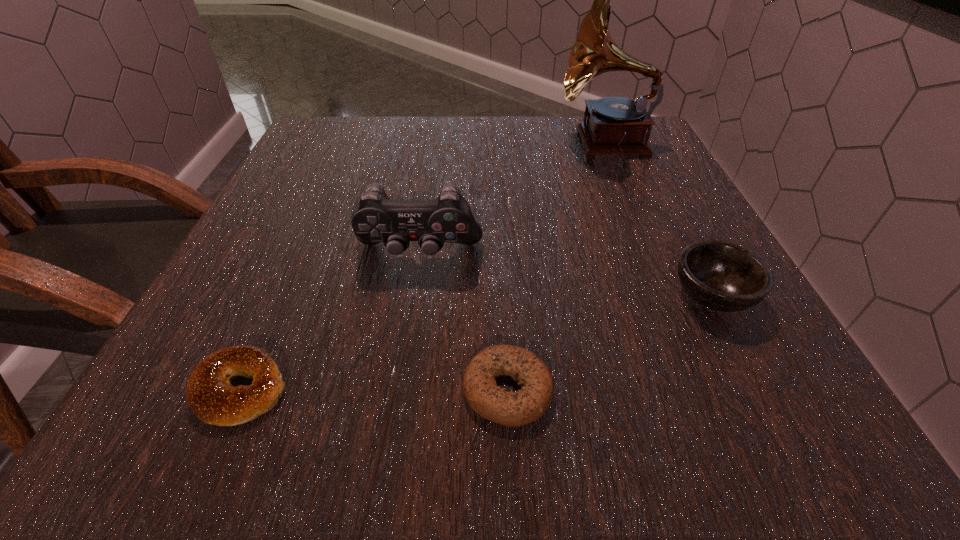
At what (x,y) coordinates should I click in order to perform the action: click on the tallest object. Please return your answer as a coordinate pair (x, y). The height and width of the screenshot is (540, 960). Looking at the image, I should click on (615, 125).

The height and width of the screenshot is (540, 960). What are the coordinates of `phonograph_record` in the screenshot? It's located at (615, 125).

Where is `control`? The height and width of the screenshot is (540, 960). control is located at coordinates (377, 218).

The image size is (960, 540). In order to click on the third shortest object in this screenshot , I will do `click(725, 277)`.

At what (x,y) coordinates should I click in order to perform the action: click on the right bagel. Please return your answer as a coordinate pair (x, y). The image size is (960, 540). Looking at the image, I should click on (533, 377).

The height and width of the screenshot is (540, 960). In order to click on the left bagel in this screenshot , I will do `click(210, 395)`.

I want to click on free spot located 0.200m on the horn of the tallest object, so click(x=472, y=141).

This screenshot has width=960, height=540. In order to click on vacant space located 0.390m on the horn of the tallest object in this screenshot , I will do `click(390, 141)`.

In order to click on free space located on the horn of the tallest object in this screenshot , I will do `click(424, 141)`.

At what (x,y) coordinates should I click in order to perform the action: click on free location located on the surface of the fourth shortest object with buttons. Please return your answer as a coordinate pair (x, y). The width and height of the screenshot is (960, 540). Looking at the image, I should click on (390, 444).